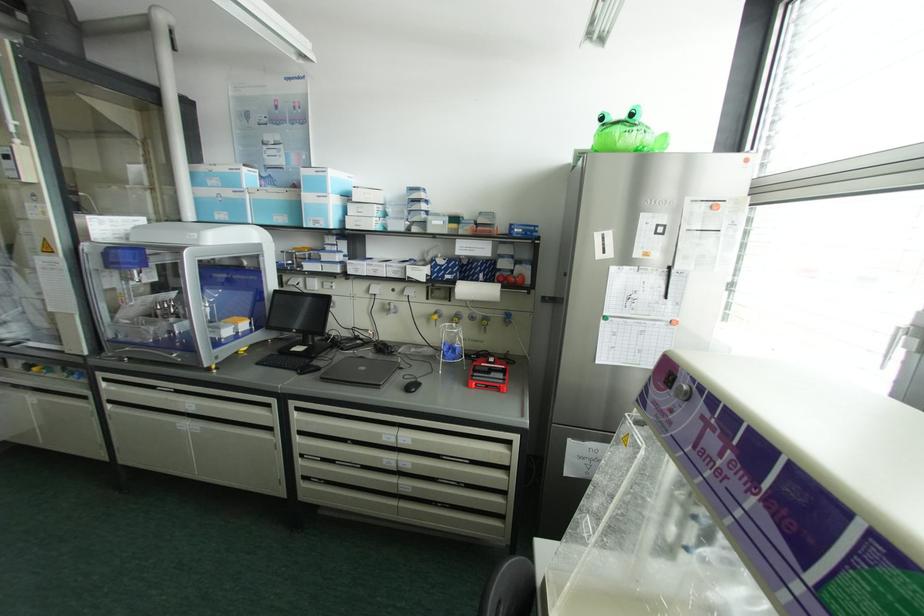
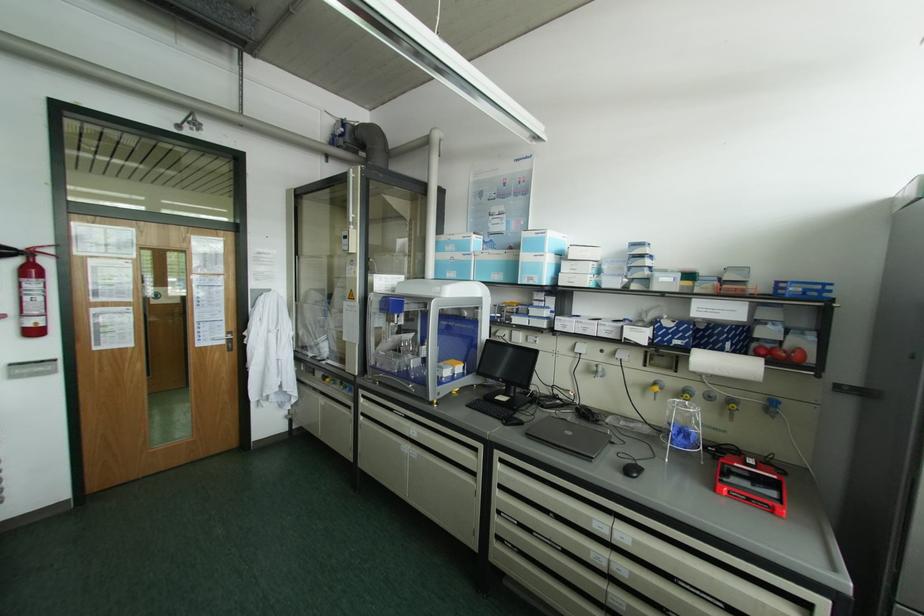
Where in the second image is the point corresponding to pixel 439 315 from the first image?

(660, 387)